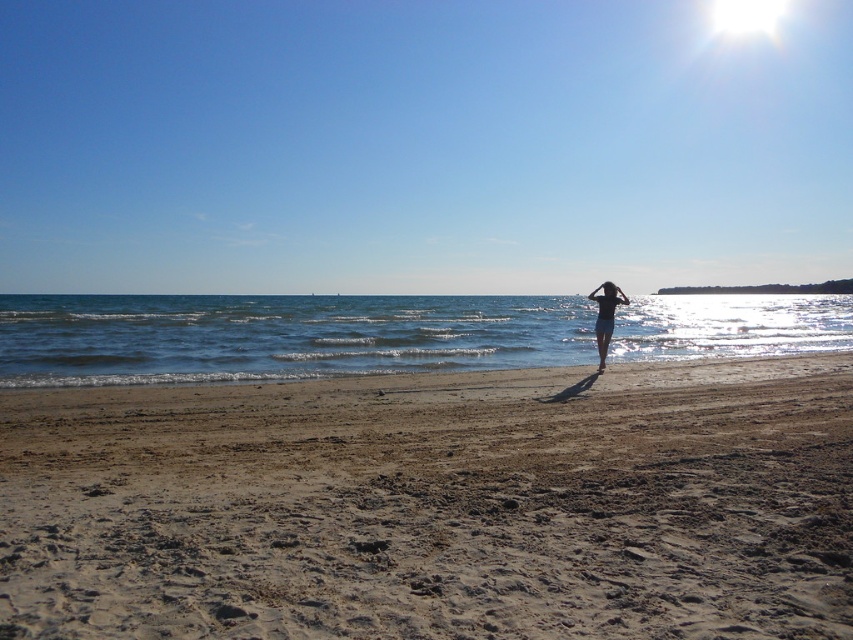
Between brown sandy beach at lower center and blue water at center, which one appears on the left side from the viewer's perspective?

From the viewer's perspective, blue water at center appears more on the left side.

This screenshot has width=853, height=640. Describe the element at coordinates (436, 506) in the screenshot. I see `brown sandy beach at lower center` at that location.

Is point (0, 465) positioned in front of point (724, 323)?

Yes.

At what (x,y) coordinates should I click in order to perform the action: click on brown sandy beach at lower center. Please return your answer as a coordinate pair (x, y). Image resolution: width=853 pixels, height=640 pixels. Looking at the image, I should click on (x=436, y=506).

Between blue water at center and blue fabric swimsuit at center, which one is positioned higher?

blue water at center is above.

Is point (329, 374) behind point (602, 352)?

No, (329, 374) is closer to viewer.

The image size is (853, 640). What are the coordinates of `blue water at center` in the screenshot? It's located at (280, 337).

Is point (842, 529) more distant than point (602, 340)?

No.

Between brown sandy beach at lower center and blue fabric swimsuit at center, which one is positioned lower?

Positioned lower is brown sandy beach at lower center.

This screenshot has width=853, height=640. Find the location of `brown sandy beach at lower center`. brown sandy beach at lower center is located at coordinates (436, 506).

Find the location of `brown sandy beach at lower center`. brown sandy beach at lower center is located at coordinates click(436, 506).